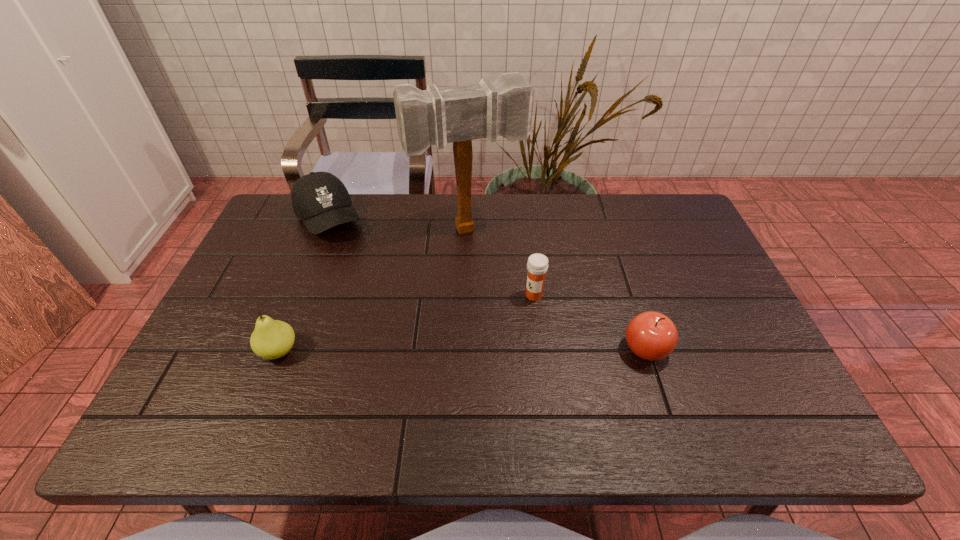
Where is `pear that is at the left edge`? The width and height of the screenshot is (960, 540). pear that is at the left edge is located at coordinates coord(271,339).

In order to click on baseball cap at the left edge in this screenshot , I will do `click(320, 199)`.

Identify the location of object that is at the far left corner. (320, 199).

This screenshot has width=960, height=540. Find the location of `object present at the near left corner`. object present at the near left corner is located at coordinates coord(271,339).

Locate an element on the screen. This screenshot has height=540, width=960. free space at the far edge of the desktop is located at coordinates (534, 220).

I want to click on free region at the near edge of the desktop, so click(538, 400).

In the image, there is a desktop. Where is `vacant space at the left edge`? This screenshot has width=960, height=540. vacant space at the left edge is located at coordinates (297, 275).

You are a GUI agent. You are given a task and a screenshot of the screen. Output one action in this format:
    pyautogui.click(x=<x>, y=<y>)
    Task: Click on the free location at the right edge
    This screenshot has height=540, width=960.
    Given the screenshot: What is the action you would take?
    pyautogui.click(x=687, y=268)

You are a GUI agent. You are given a task and a screenshot of the screen. Output one action in this format:
    pyautogui.click(x=<x>, y=<y>)
    Task: Click on the vacant space at the far left corner of the desktop
    This screenshot has height=540, width=960.
    Given the screenshot: What is the action you would take?
    pyautogui.click(x=287, y=197)

You are a GUI agent. You are given a task and a screenshot of the screen. Output one action in this format:
    pyautogui.click(x=<x>, y=<y>)
    Task: Click on the free point at the far right corner
    Image resolution: width=960 pixels, height=540 pixels.
    Given the screenshot: What is the action you would take?
    pyautogui.click(x=677, y=217)